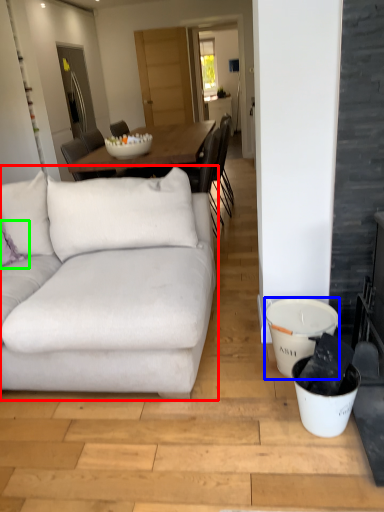
Question: Based on their relative distances, which object is farther from studio couch (highlighted by a red box)? Choose from bucket (highlighted by a blue box) and pillow (highlighted by a green box).

Choices:
 (A) bucket
 (B) pillow

Answer: (A)